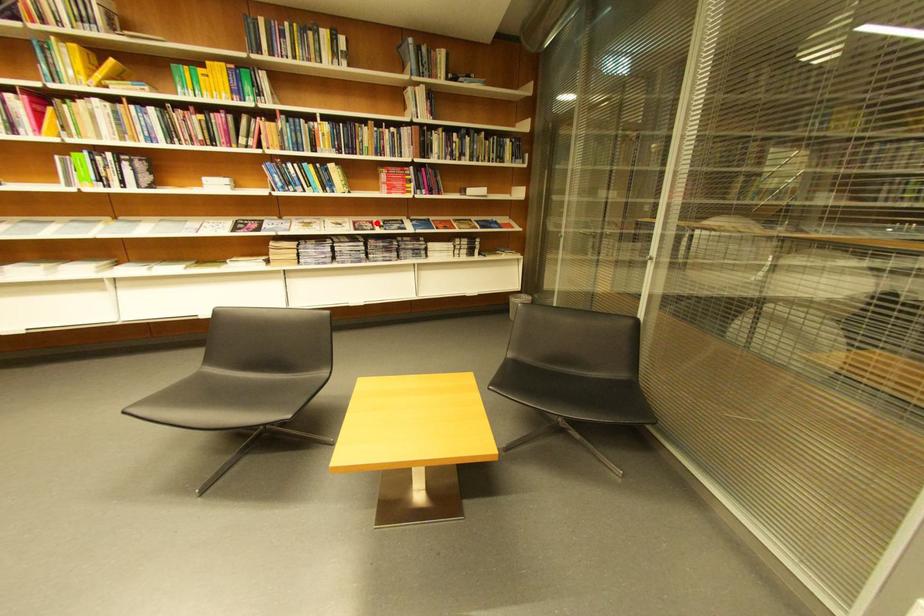
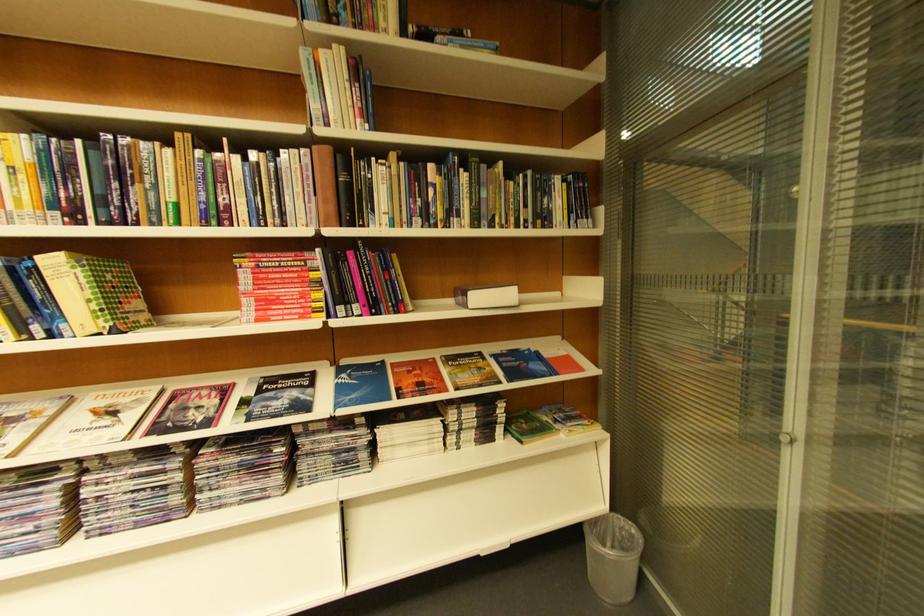
Question: I am providing you with two images of the same scene from different viewpoints. Given a red point in image1, look at the same physical point in image2. Is it:

Choices:
 (A) Closer to the viewpoint
 (B) Farther from the viewpoint

Answer: (B)